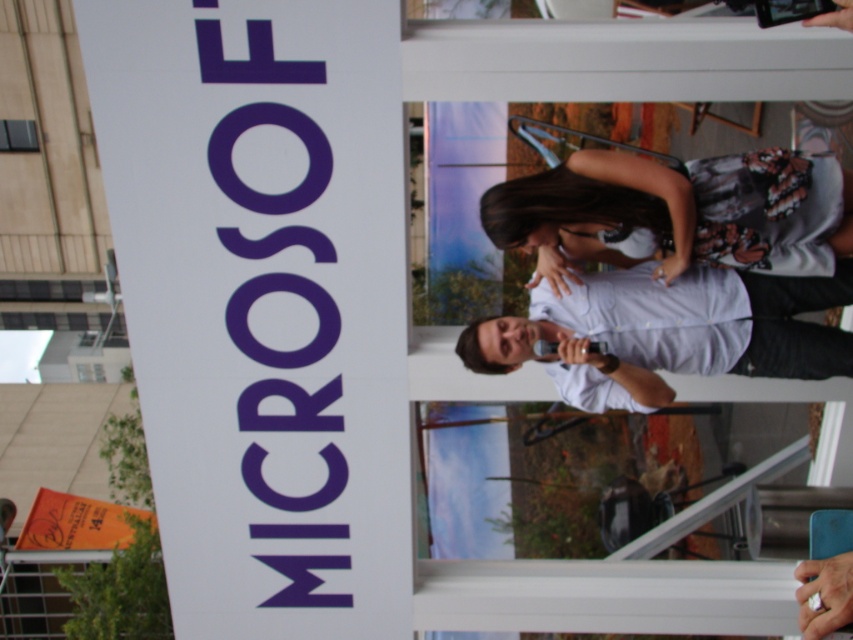
Question: Can you confirm if floral-patterned fabric at center is bigger than white matte shirt at center?

Choices:
 (A) no
 (B) yes

Answer: (A)

Question: Which point appears farthest from the camera in this image?

Choices:
 (A) (665, 184)
 (B) (254, 122)

Answer: (B)

Question: Which point is farther from the camera taking this photo?

Choices:
 (A) (613, 403)
 (B) (808, 193)
 (C) (384, 180)

Answer: (A)

Question: Can you confirm if white paper sign at upper left is thinner than white matte shirt at center?

Choices:
 (A) yes
 (B) no

Answer: (A)

Question: Among these objects, which one is nearest to the camera?

Choices:
 (A) white paper sign at upper left
 (B) white matte shirt at center

Answer: (A)

Question: From the image, what is the correct spatial relationship of white paper sign at upper left in relation to floral-patterned fabric at center?

Choices:
 (A) above
 (B) below

Answer: (B)